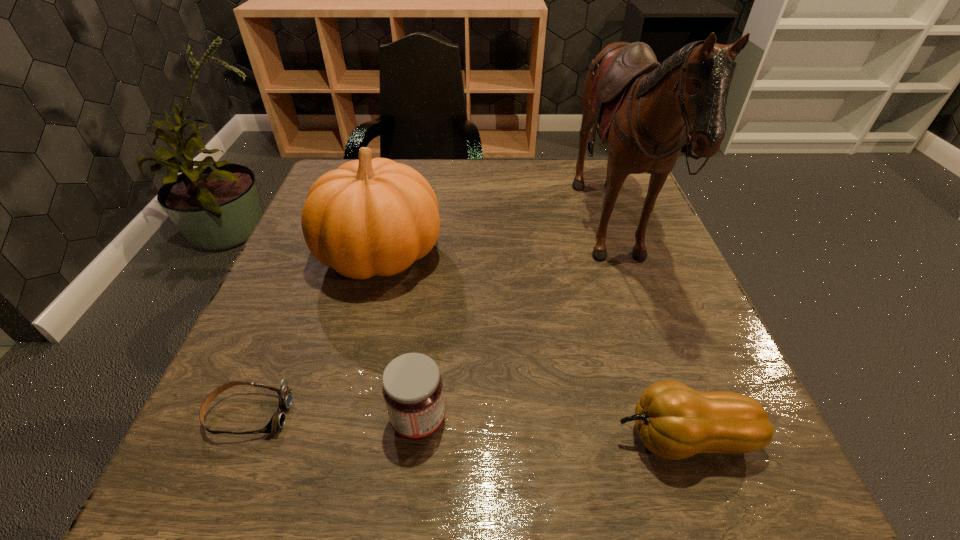
The image size is (960, 540). I want to click on free point between the gourd and the jam, so click(x=551, y=429).

Where is `empty space between the fourth shortest object and the gourd`? The width and height of the screenshot is (960, 540). empty space between the fourth shortest object and the gourd is located at coordinates (533, 347).

What are the coordinates of `free space between the shortest object and the gourd` in the screenshot? It's located at (467, 426).

Image resolution: width=960 pixels, height=540 pixels. I want to click on vacant area that lies between the goggles and the pumpkin, so click(316, 335).

Where is `free space between the jam and the goggles`? Image resolution: width=960 pixels, height=540 pixels. free space between the jam and the goggles is located at coordinates (334, 417).

The image size is (960, 540). In order to click on vacant area that lies between the shortest object and the jam in this screenshot , I will do click(334, 417).

Locate an element on the screen. empty location between the gourd and the tallest object is located at coordinates (648, 338).

Find the location of a particular element. The width and height of the screenshot is (960, 540). free space between the fourth shortest object and the gourd is located at coordinates (533, 347).

I want to click on free area in between the jam and the gourd, so click(x=551, y=429).

Identify the location of unoccupied area between the goggles and the jam. (334, 417).